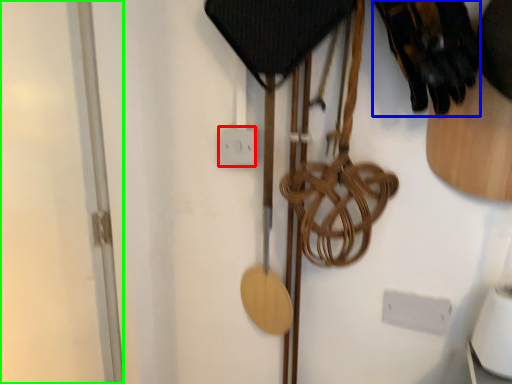
Question: Which object is the closest to the electric outlet (highlighted by a red box)? Choose among these: footwear (highlighted by a blue box) or glass door (highlighted by a green box).

Choices:
 (A) footwear
 (B) glass door

Answer: (A)